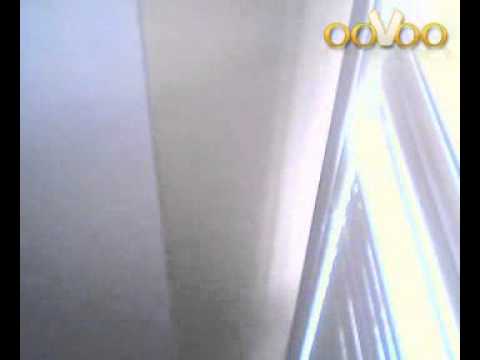
Locate an element on the screen. rod is located at coordinates (336, 148).